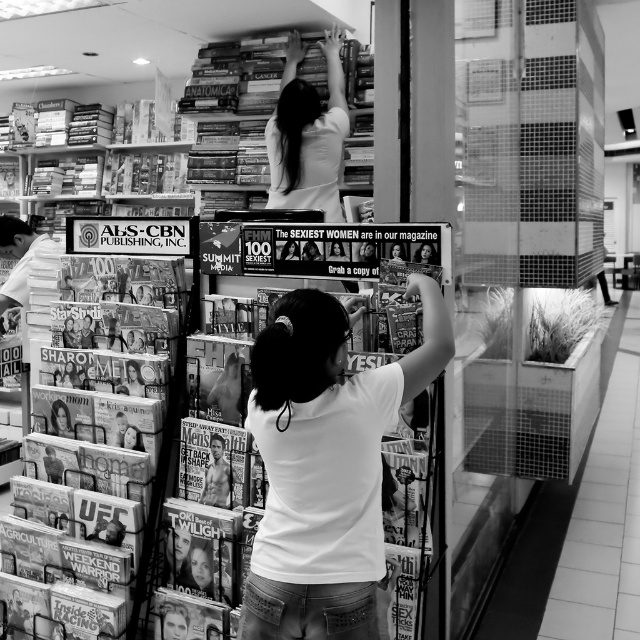
Who is positioned more to the left, white matte shirt at center or smooth glossy magazine at center?

From the viewer's perspective, smooth glossy magazine at center appears more on the left side.

Can you confirm if white matte shirt at center is taller than smooth glossy magazine at center?

Indeed, white matte shirt at center has a greater height compared to smooth glossy magazine at center.

Who is more forward, (316,381) or (211,451)?

Point (316,381)

Identify the location of white matte shirt at center. (324, 465).

Does point (342, 436) come closer to viewer compared to point (42, 209)?

Yes, point (342, 436) is in front of point (42, 209).

Does white matte shirt at center have a larger size compared to hardcover books at upper left?

No, white matte shirt at center is not bigger than hardcover books at upper left.

Is point (280, 490) farther from viewer compared to point (148, 156)?

No, it is not.

Identify the location of white matte shirt at center. (324, 465).

Who is shorter, white matte shirt at upper center or matte glossy magazines at lower left?

white matte shirt at upper center is shorter.

Can you confirm if white matte shirt at upper center is positioned above matte glossy magazines at lower left?

Yes.

Locate an element on the screen. The width and height of the screenshot is (640, 640). white matte shirt at upper center is located at coordinates (307, 134).

Locate an element on the screen. This screenshot has width=640, height=640. white matte shirt at upper center is located at coordinates coord(307,134).